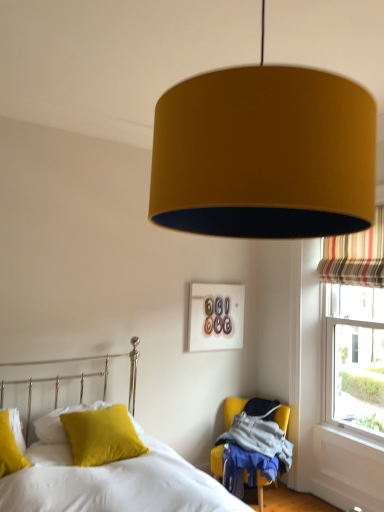
Question: Is mustard fabric chair at lower right to the right of mustard fabric lampshade at upper center from the viewer's perspective?

Choices:
 (A) yes
 (B) no

Answer: (A)

Question: Considering the relative sizes of mustard fabric chair at lower right and mustard fabric lampshade at upper center in the image provided, is mustard fabric chair at lower right bigger than mustard fabric lampshade at upper center?

Choices:
 (A) yes
 (B) no

Answer: (B)

Question: Is the depth of mustard fabric chair at lower right less than that of mustard fabric lampshade at upper center?

Choices:
 (A) no
 (B) yes

Answer: (A)

Question: Does mustard fabric chair at lower right have a greater height compared to mustard fabric lampshade at upper center?

Choices:
 (A) yes
 (B) no

Answer: (B)

Question: Is mustard fabric chair at lower right further to the viewer compared to mustard fabric lampshade at upper center?

Choices:
 (A) yes
 (B) no

Answer: (A)

Question: From a real-world perspective, is mustard fabric chair at lower right on mustard fabric lampshade at upper center?

Choices:
 (A) yes
 (B) no

Answer: (B)

Question: Considering the relative sizes of soft yellow pillow at lower left and matte yellow pillow at lower left, the second pillow from the front, in the image provided, is soft yellow pillow at lower left thinner than matte yellow pillow at lower left, the second pillow from the front,?

Choices:
 (A) no
 (B) yes

Answer: (A)

Question: Can you confirm if soft yellow pillow at lower left is taller than matte yellow pillow at lower left, the second pillow when ordered from back to front?

Choices:
 (A) no
 (B) yes

Answer: (B)

Question: Does soft yellow pillow at lower left have a larger size compared to matte yellow pillow at lower left, the second pillow from the front?

Choices:
 (A) yes
 (B) no

Answer: (A)

Question: Is the depth of soft yellow pillow at lower left greater than that of matte yellow pillow at lower left, the second pillow from the front?

Choices:
 (A) no
 (B) yes

Answer: (A)

Question: Does soft yellow pillow at lower left appear on the right side of matte yellow pillow at lower left, the second pillow from the front?

Choices:
 (A) yes
 (B) no

Answer: (A)

Question: From the image's perspective, does soft yellow pillow at lower left appear lower than matte yellow pillow at lower left, the second pillow when ordered from back to front?

Choices:
 (A) yes
 (B) no

Answer: (A)

Question: Considering the relative sizes of velvet yellow pillow at lower left, which is the 3th pillow from front to back, and matte yellow pillow at lower left, the second pillow when ordered from back to front, in the image provided, is velvet yellow pillow at lower left, which is the 3th pillow from front to back, thinner than matte yellow pillow at lower left, the second pillow when ordered from back to front,?

Choices:
 (A) no
 (B) yes

Answer: (B)